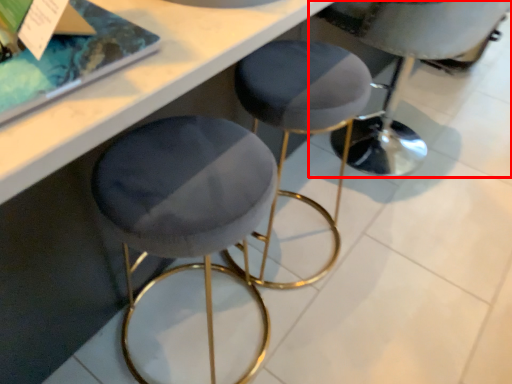
Question: Where is swivel chair (annotated by the red box) located in relation to stool in the image?

Choices:
 (A) right
 (B) left

Answer: (A)